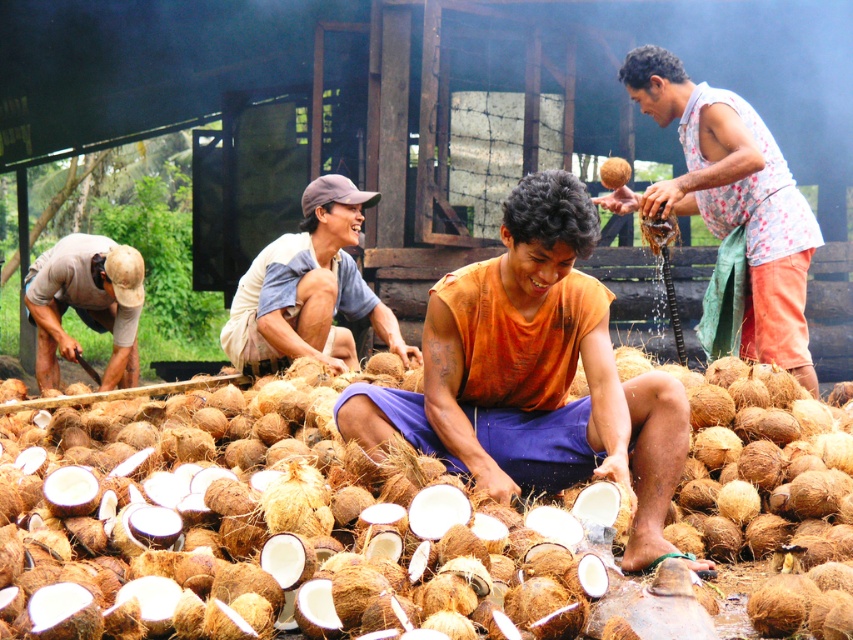
You are a worker in the coconut processing area. You need to place a new coconut on the ground between the brown rough coconut at center and the orange fabric at center. What is the minimum distance you should keep between the new coconut and each of these two objects to ensure it fits without overlapping?

The minimum distance you should keep between the new coconut and each of the two objects is 8.8 inches, as the total distance between the brown rough coconut at center and orange fabric at center is 17.60 inches. Dividing this distance equally would allow the new coconut to be placed exactly in the middle without overlapping.

You are a worker in the coconut processing area. You notice the brown rough coconut at center and the orange fabric at center. Which object is located below the other?

The brown rough coconut at center is positioned under the orange fabric at center.